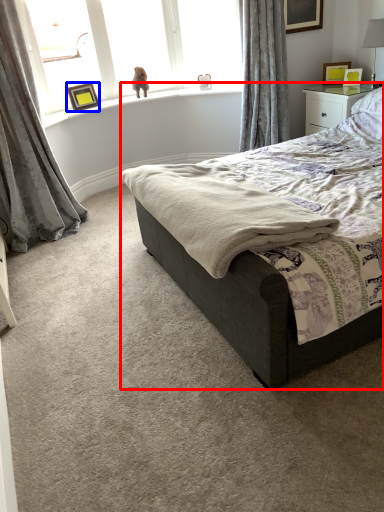
Question: Which object appears closest to the camera in this image, bed (highlighted by a red box) or picture frame (highlighted by a blue box)?

Choices:
 (A) bed
 (B) picture frame

Answer: (A)